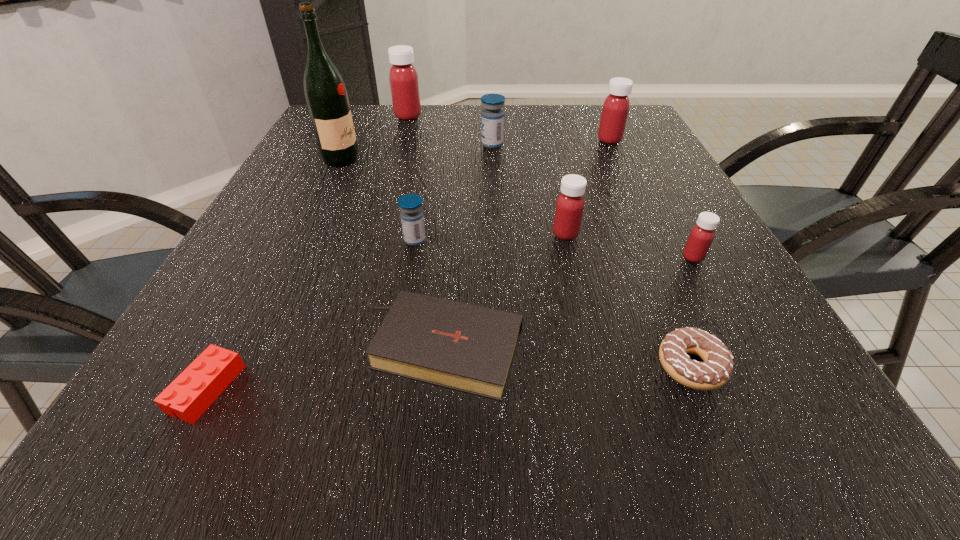
This screenshot has width=960, height=540. Find the location of `the fifth medicine from right to left`. the fifth medicine from right to left is located at coordinates (412, 219).

Identify the location of the smaller blue medicine. Image resolution: width=960 pixels, height=540 pixels. (412, 219).

This screenshot has height=540, width=960. I want to click on the smallest red medicine, so click(701, 236).

The height and width of the screenshot is (540, 960). What are the coordinates of `the nearest medicine` in the screenshot? It's located at (701, 236).

What are the coordinates of `Bible` in the screenshot? It's located at (468, 348).

Where is `chocolate doughnut`? The width and height of the screenshot is (960, 540). chocolate doughnut is located at coordinates (715, 371).

You are a GUI agent. You are given a task and a screenshot of the screen. Output one action in this format:
    pyautogui.click(x=<x>, y=<y>)
    Task: Click on the red Lego
    This screenshot has height=540, width=960.
    Given the screenshot: What is the action you would take?
    pyautogui.click(x=199, y=385)

Where is `vacant space situated 0.380m on the front-facing side of the fourth farthest object`? The width and height of the screenshot is (960, 540). vacant space situated 0.380m on the front-facing side of the fourth farthest object is located at coordinates (514, 160).

At what (x,y) coordinates should I click in order to perform the action: click on free space located on the front of the farthest medicine. Please return your answer as a coordinate pair (x, y). Looking at the image, I should click on (397, 154).

This screenshot has width=960, height=540. I want to click on free spot located 0.340m on the left of the second tallest medicine, so coord(468,140).